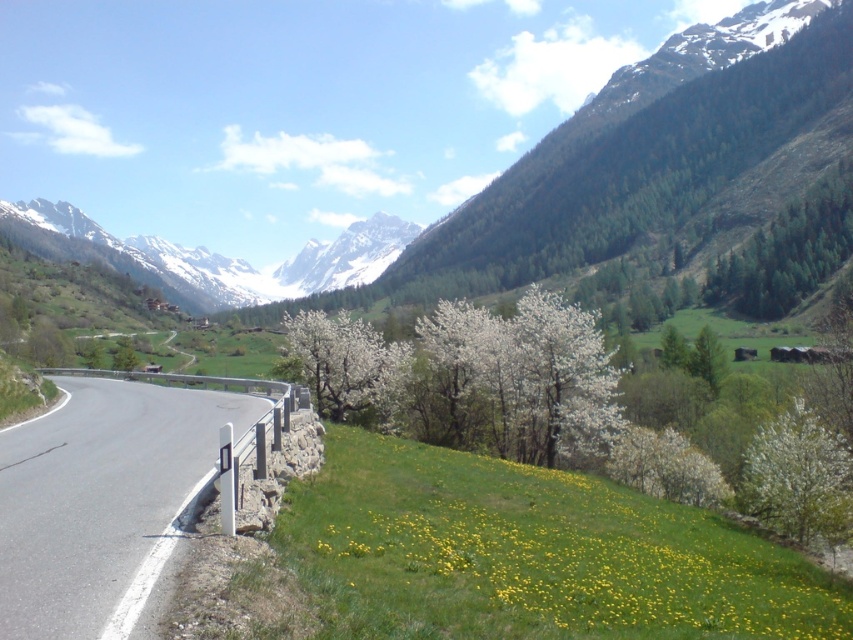
Question: Which of these objects is positioned farthest from the green textured trees at upper right?

Choices:
 (A) green forested mountain at upper center
 (B) yellow grass at lower right

Answer: (B)

Question: Is yellow grass at lower right to the left of asphalt road at lower left from the viewer's perspective?

Choices:
 (A) yes
 (B) no

Answer: (B)

Question: Can you confirm if green forested mountain at upper center is smaller than asphalt road at lower left?

Choices:
 (A) yes
 (B) no

Answer: (B)

Question: Considering the real-world distances, which object is farthest from the asphalt road at lower left?

Choices:
 (A) green forested mountain at upper center
 (B) green textured trees at upper right

Answer: (A)

Question: Does yellow grass at lower right appear on the left side of green textured trees at upper right?

Choices:
 (A) no
 (B) yes

Answer: (B)

Question: Among these objects, which one is nearest to the camera?

Choices:
 (A) green forested mountain at upper center
 (B) asphalt road at lower left
 (C) snowy granite mountains at upper center

Answer: (B)